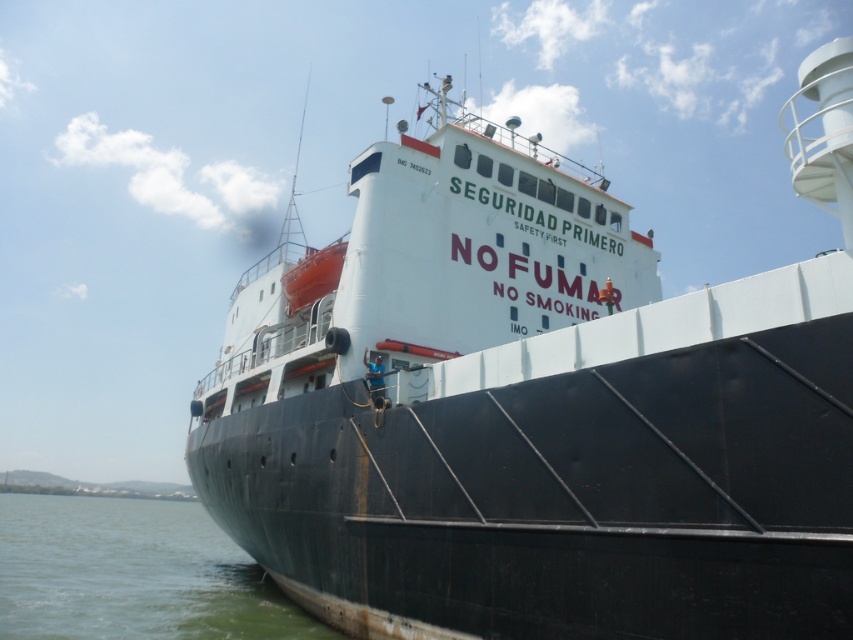
You are a sailor standing on the deck of the black matte ship at center. You notice the green water at lower left. Based on their heights, which one is shorter?

The black matte ship at center is shorter than the green water at lower left.

You are a safety inspector on a boat that is 12 meters long. You need to dock your boat near the black matte ship at center without getting too close to the green water at lower left. Can your boat fit in the space between them?

The distance between the black matte ship at center and the green water at lower left is 13.50 meters. Since your boat is 12 meters long, it can fit in the space between them as there is enough room.

You are standing on the dock and looking at the black matte ship at center and the green water at lower left. Which object is positioned higher from the ground level?

The black matte ship at center is positioned higher than the green water at lower left because it is above it.